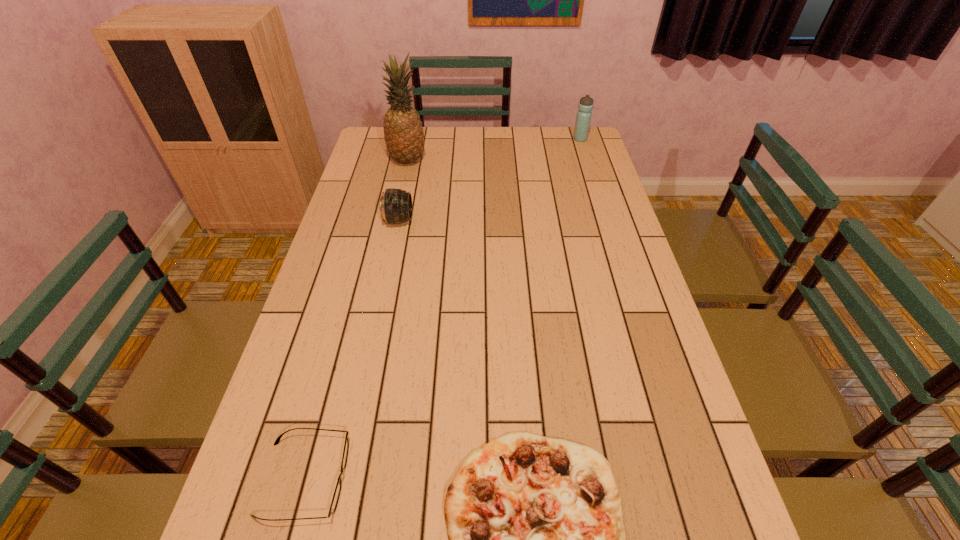
Where is `vacant region at the left edge of the desktop`? This screenshot has width=960, height=540. vacant region at the left edge of the desktop is located at coordinates (266, 435).

The width and height of the screenshot is (960, 540). What are the coordinates of `vacant space at the right edge of the desktop` in the screenshot? It's located at (589, 164).

I want to click on free space at the far right corner, so click(x=556, y=150).

Find the location of a particular element. free space that is in between the water bottle and the spectacles is located at coordinates (443, 309).

You are a GUI agent. You are given a task and a screenshot of the screen. Output one action in this format:
    pyautogui.click(x=<x>, y=<y>)
    Task: Click on the free space that is in between the spectacles and the rightmost object
    Image resolution: width=960 pixels, height=540 pixels.
    Given the screenshot: What is the action you would take?
    pyautogui.click(x=443, y=309)

The image size is (960, 540). Find the location of `object that ranks as the third closest to the telephoto lens`. object that ranks as the third closest to the telephoto lens is located at coordinates (537, 539).

Identify the location of object that can be found as the third closest to the third shortest object. This screenshot has width=960, height=540. (537, 539).

Identify the location of vacant area that satisfies the following two spatial constraints: 1. on the back side of the water bottle; 2. on the left side of the tallest object. This screenshot has width=960, height=540. (412, 139).